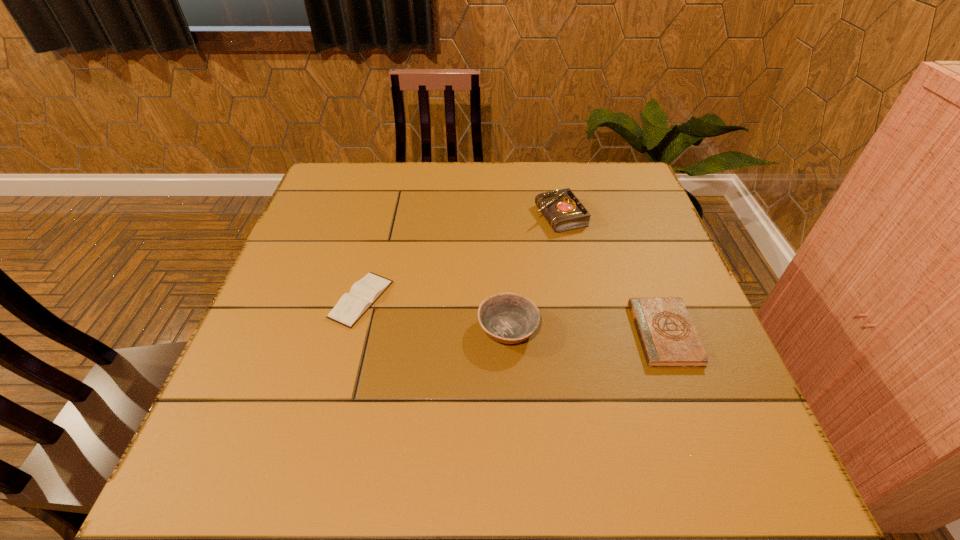
At what (x,y) coordinates should I click in order to perform the action: click on diary that stands as the closest to the rightmost object. Please return your answer as a coordinate pair (x, y). Image resolution: width=960 pixels, height=540 pixels. Looking at the image, I should click on (562, 209).

Locate an element on the screen. This screenshot has width=960, height=540. the closest diary to the rightmost diary is located at coordinates 562,209.